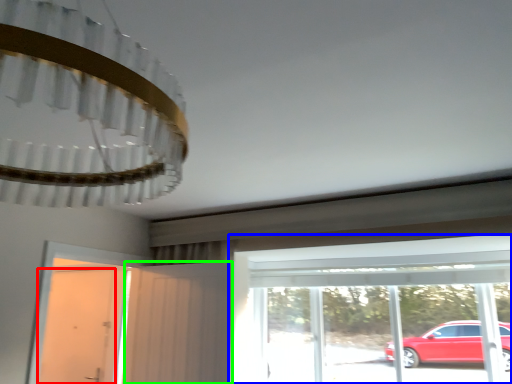
Question: Which object is positioned closest to door (highlighted by a red box)? Select from window (highlighted by a blue box) and screen door (highlighted by a green box).

Choices:
 (A) window
 (B) screen door

Answer: (B)